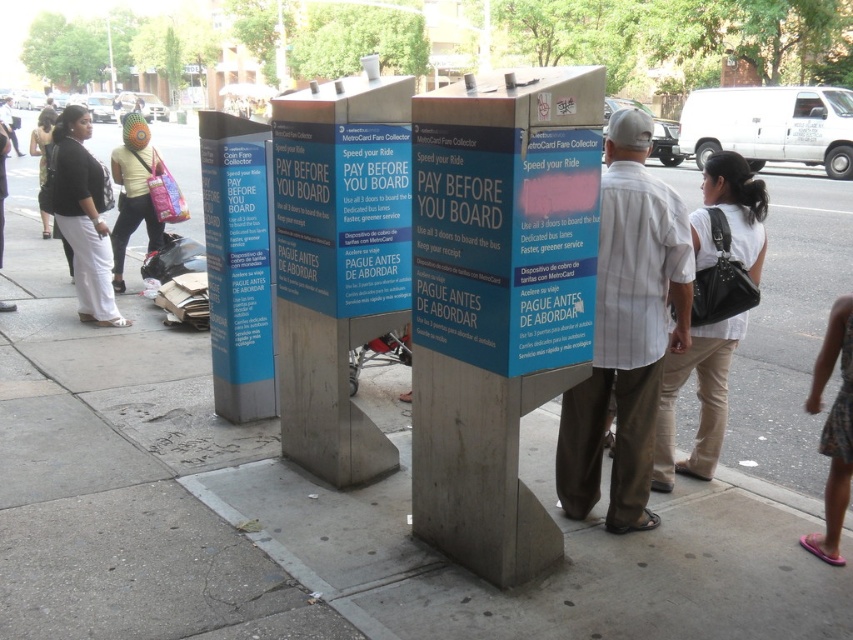
You are standing at the point marked as point [595,381] in front of the MTA fare collection machines. You want to move to the nearest machine, which is 3 meters away from you. Can you reach it without moving more than 3.64 meters?

The distance between you and the viewer is 3.64 meters, so yes, you can reach the nearest machine which is 3 meters away without exceeding that distance.